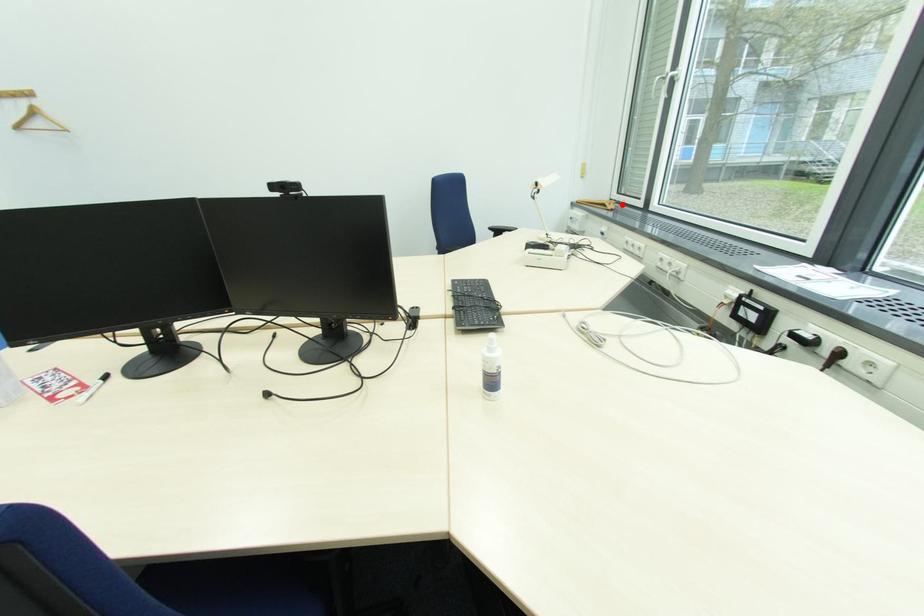
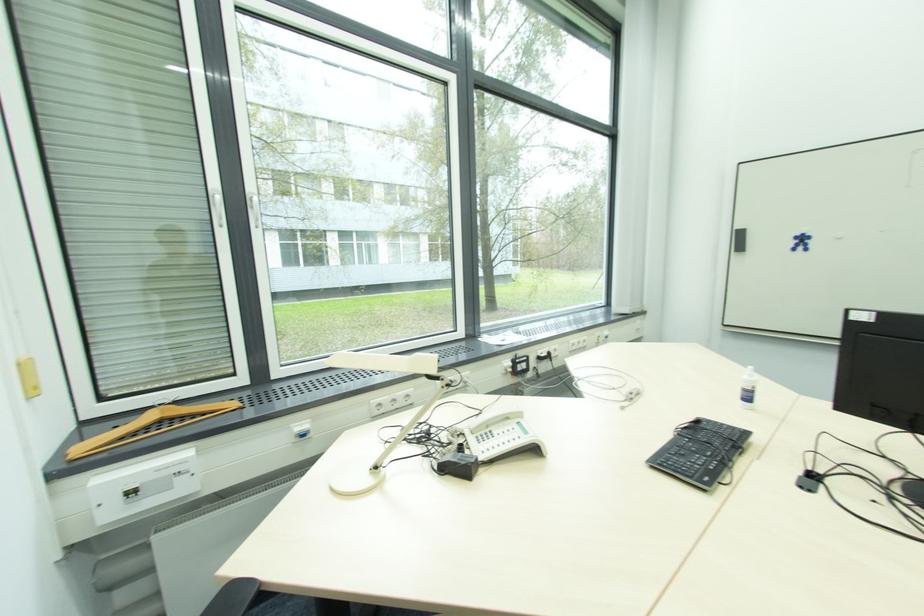
Question: A red point is marked in image1. In image2, is the corresponding 3D point closer to the camera or farther? Reply with the corresponding letter.

Choices:
 (A) The corresponding 3D point is closer.
 (B) The corresponding 3D point is farther.

Answer: (B)